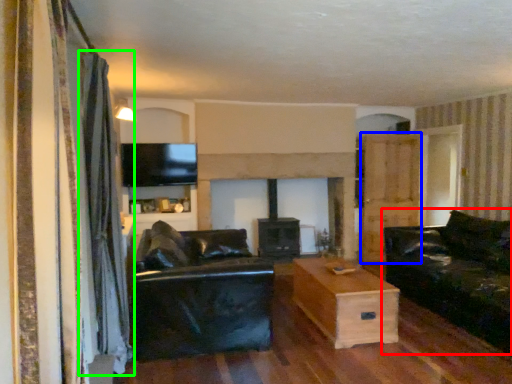
Question: Based on their relative distances, which object is nearer to studio couch (highlighted by a red box)? Choose from armoire (highlighted by a blue box) and curtain (highlighted by a green box).

Choices:
 (A) armoire
 (B) curtain

Answer: (A)